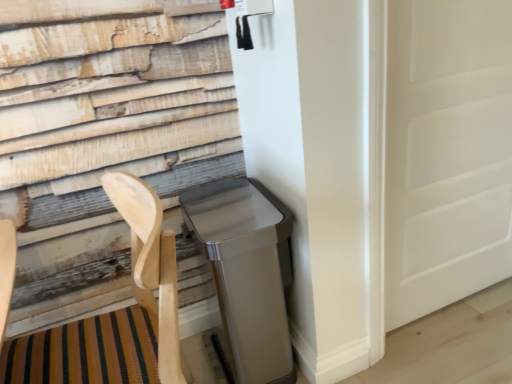
At what (x,y) coordinates should I click in order to perform the action: click on vacant area that is in front of white matte door at right. Please return your answer as a coordinate pair (x, y). Looking at the image, I should click on (472, 350).